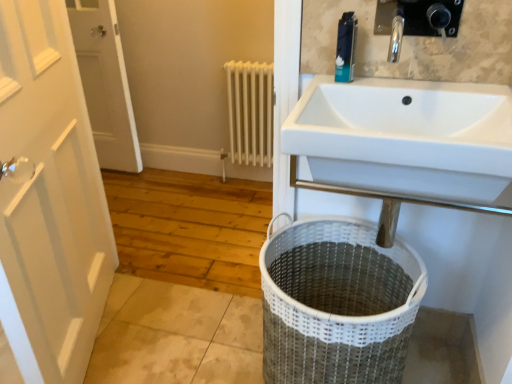
This screenshot has height=384, width=512. I want to click on empty space that is to the right of white wooden door at left, arranged as the 2th door when viewed from the left, so [x=175, y=341].